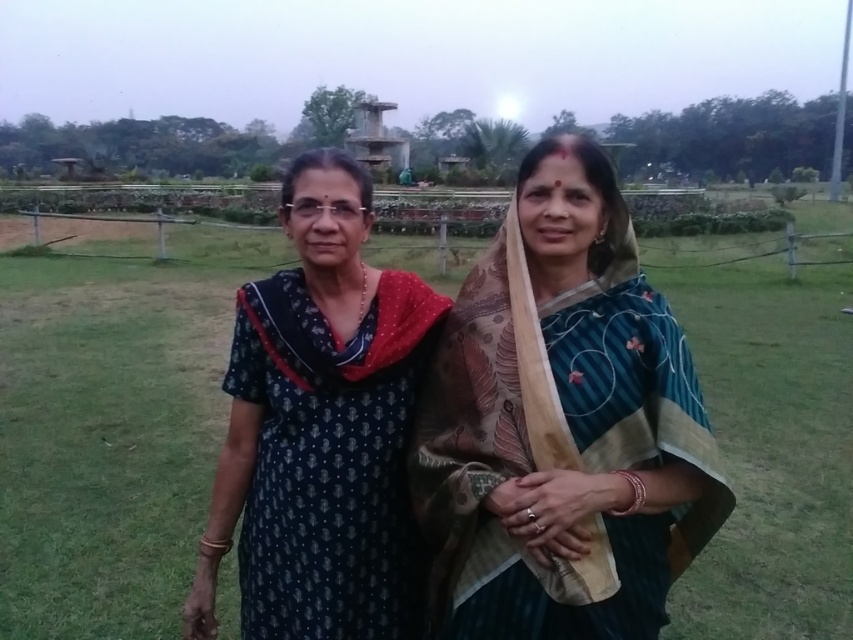
Question: Is dark blue fabric dress at center in front of embroidered silk saree at center?

Choices:
 (A) no
 (B) yes

Answer: (A)

Question: Which object is the closest to the embroidered silk saree at center?

Choices:
 (A) dark blue fabric dress at center
 (B) dark blue printed dress at center

Answer: (B)

Question: In this image, where is embroidered silk saree at center located relative to dark blue printed dress at center?

Choices:
 (A) right
 (B) left

Answer: (A)

Question: Which of the following is the farthest from the observer?

Choices:
 (A) dark blue fabric dress at center
 (B) dark blue printed dress at center
 (C) embroidered silk saree at center

Answer: (A)

Question: Does dark blue fabric dress at center appear on the right side of dark blue printed dress at center?

Choices:
 (A) yes
 (B) no

Answer: (A)

Question: Which point appears closest to the camera in this image?

Choices:
 (A) (595, 298)
 (B) (299, 163)

Answer: (A)